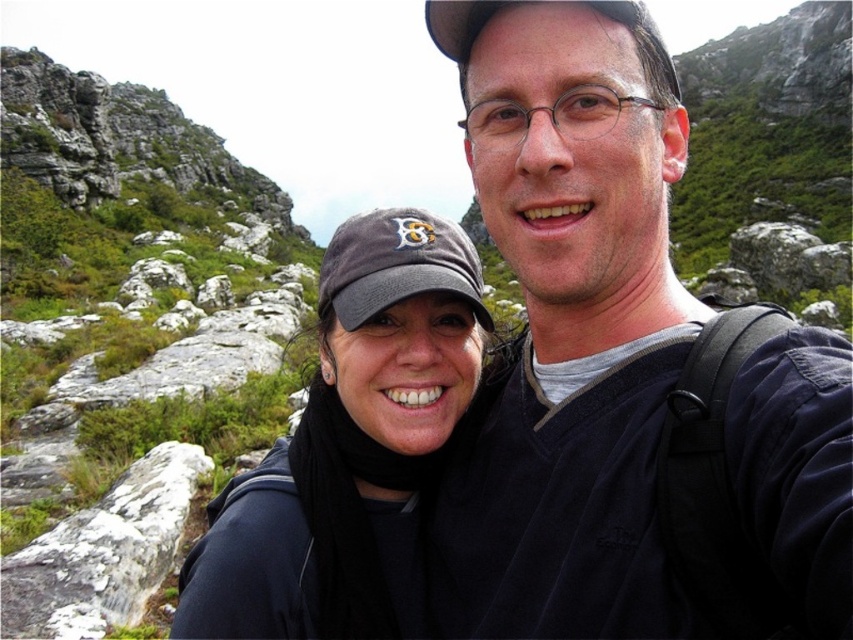
You are a photographer planning to take a group photo in this mountainous area. You want to ensure that the matte black jacket at center and the white textured rock at lower left are both clearly visible in the frame. Considering their sizes, which object should you position closer to the camera to maintain their visibility?

The matte black jacket at center has a larger size compared to the white textured rock at lower left. To maintain visibility, position the smaller white textured rock at lower left closer to the camera so its size in the frame matches the larger matte black jacket at center.

You are standing in the mountainous area shown in the image. You see the dark gray fabric cap at center and the white textured rock at lower left. Which object is positioned farther to the east?

The dark gray fabric cap at center is to the right of the white textured rock at lower left, so if the rock is at lower left, the cap is positioned farther to the east.

You are a photographer trying to capture a closeup shot of the dark gray fabric cap at center and the white textured rock at lower left. Since you want both subjects to appear similarly sized in the photo, which object should you move closer to the camera?

Since the dark gray fabric cap at center is wider than the white textured rock at lower left, you should move closer to the white textured rock at lower left to make it appear larger in the photo, balancing their sizes.